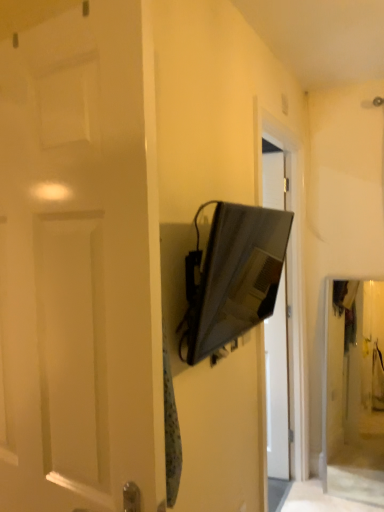
At what (x,y) coordinates should I click in order to perform the action: click on satin black tv at center. Please return your answer as a coordinate pair (x, y). Image resolution: width=384 pixels, height=512 pixels. Looking at the image, I should click on (233, 276).

What do you see at coordinates (233, 276) in the screenshot?
I see `satin black tv at center` at bounding box center [233, 276].

What are the coordinates of `white matte door at left` in the screenshot? It's located at (81, 262).

Describe the element at coordinates (81, 262) in the screenshot. I see `white matte door at left` at that location.

Identify the location of satin black tv at center. This screenshot has width=384, height=512. (233, 276).

Would you say white matte door at left is to the left or to the right of satin black tv at center in the picture?

From the image, it's evident that white matte door at left is to the left of satin black tv at center.

Which object is more forward, white matte door at left or satin black tv at center?

white matte door at left.

Which point is more distant from viewer, (135, 371) or (248, 298)?

The point (248, 298) is farther from the camera.

From the image's perspective, which is above, white matte door at left or satin black tv at center?

satin black tv at center, from the image's perspective.

From a real-world perspective, which is physically below, white matte door at left or satin black tv at center?

white matte door at left.

Can you confirm if white matte door at left is wider than satin black tv at center?

Yes.

Looking at this image, considering the sizes of objects white matte door at left and satin black tv at center in the image provided, who is taller, white matte door at left or satin black tv at center?

white matte door at left is taller.

Considering the relative sizes of white matte door at left and satin black tv at center in the image provided, is white matte door at left smaller than satin black tv at center?

Incorrect, white matte door at left is not smaller in size than satin black tv at center.

Is white matte door at left not inside satin black tv at center?

That's correct, white matte door at left is outside of satin black tv at center.

Is white matte door at left touching satin black tv at center?

No, white matte door at left is not making contact with satin black tv at center.

Could you tell me if white matte door at left is facing satin black tv at center?

No, white matte door at left is not oriented towards satin black tv at center.

Measure the distance between white matte door at left and satin black tv at center.

The distance of white matte door at left from satin black tv at center is 1.47 meters.

Where is `door directly beneath the satin black tv at center (from a real-world perspective)`? The height and width of the screenshot is (512, 384). door directly beneath the satin black tv at center (from a real-world perspective) is located at coordinates (81, 262).

Is satin black tv at center to the left of white matte door at left from the viewer's perspective?

Incorrect, satin black tv at center is not on the left side of white matte door at left.

Considering their positions, is satin black tv at center located in front of or behind white matte door at left?

Visually, satin black tv at center is located behind white matte door at left.

Considering the points (246, 288) and (141, 62), which point is behind, point (246, 288) or point (141, 62)?

The point (246, 288) is farther.

From the image's perspective, is satin black tv at center over white matte door at left?

Yes, from the image's perspective, satin black tv at center is over white matte door at left.

In the scene shown: From a real-world perspective, who is located lower, satin black tv at center or white matte door at left?

white matte door at left is physically lower.

Which of these two, satin black tv at center or white matte door at left, is thinner?

satin black tv at center.

Looking at this image, from their relative heights in the image, would you say satin black tv at center is taller or shorter than white matte door at left?

Considering their sizes, satin black tv at center has less height than white matte door at left.

Is satin black tv at center smaller than white matte door at left?

Correct, satin black tv at center occupies less space than white matte door at left.

In the scene shown: Choose the correct answer: Is satin black tv at center inside white matte door at left or outside it?

satin black tv at center is not enclosed by white matte door at left.

Is the surface of satin black tv at center in direct contact with white matte door at left?

No, satin black tv at center is not beside white matte door at left.

Is satin black tv at center facing towards white matte door at left?

No, satin black tv at center is not turned towards white matte door at left.

How different are the orientations of satin black tv at center and white matte door at left in degrees?

The angle between the facing direction of satin black tv at center and the facing direction of white matte door at left is 96.7 degrees.

At what (x,y) coordinates should I click in order to perform the action: click on medicine cabinet behind the white matte door at left. Please return your answer as a coordinate pair (x, y). Looking at the image, I should click on (233, 276).

Find the location of a particular element. The height and width of the screenshot is (512, 384). medicine cabinet to the right of white matte door at left is located at coordinates tap(233, 276).

Find the location of a particular element. This screenshot has width=384, height=512. door below the satin black tv at center (from the image's perspective) is located at coordinates 81,262.